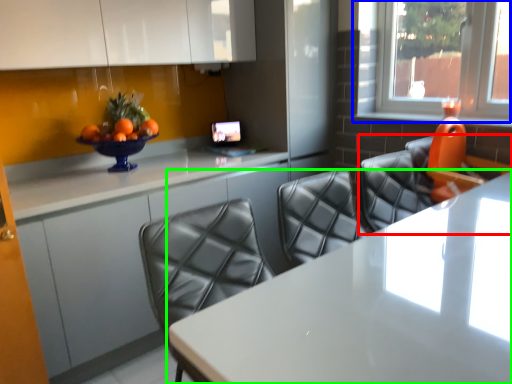
Question: Which is nearer to the chair (highlighted by a red box)? window (highlighted by a blue box) or table (highlighted by a green box).

Choices:
 (A) window
 (B) table

Answer: (B)